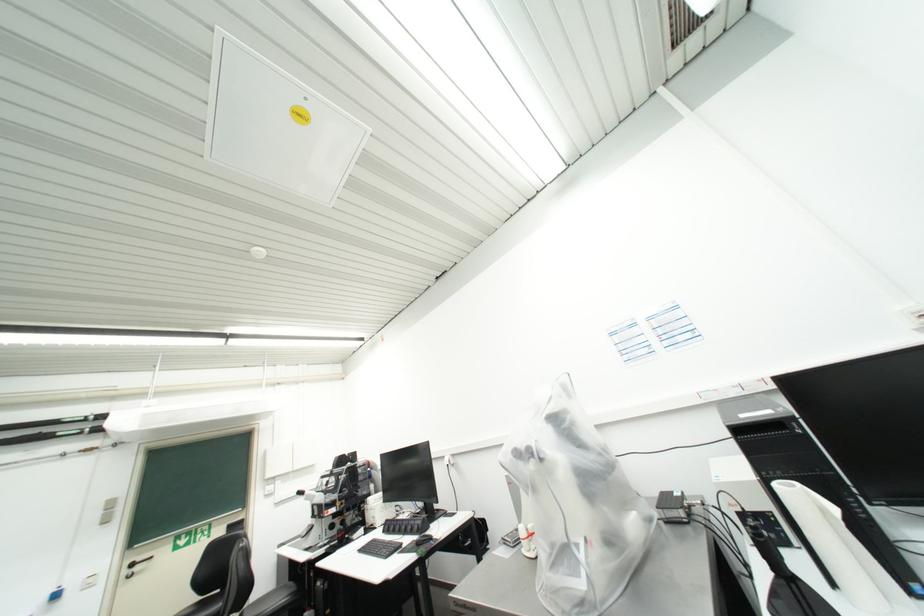
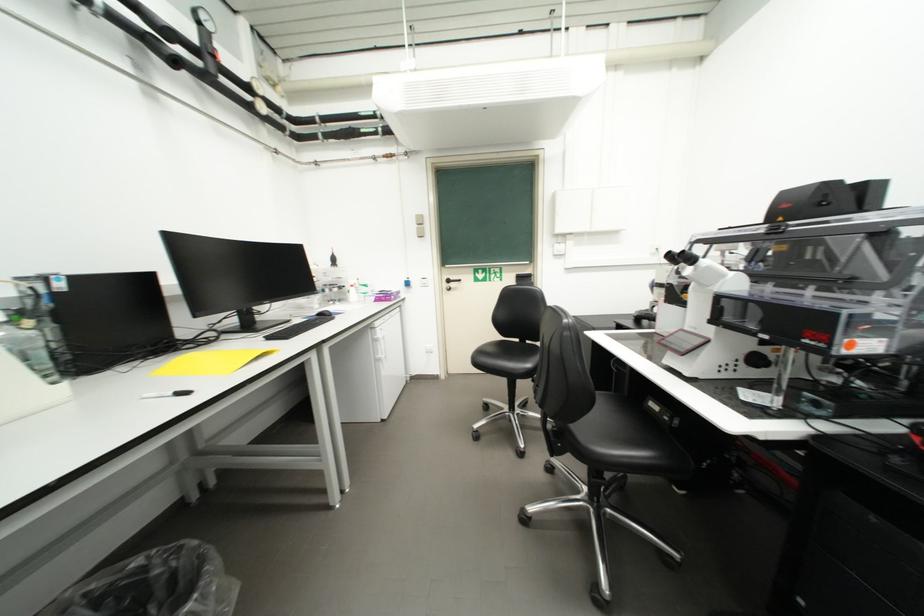
In the second image, find the point that corresponds to the point at 309,493 in the first image.

(687, 259)